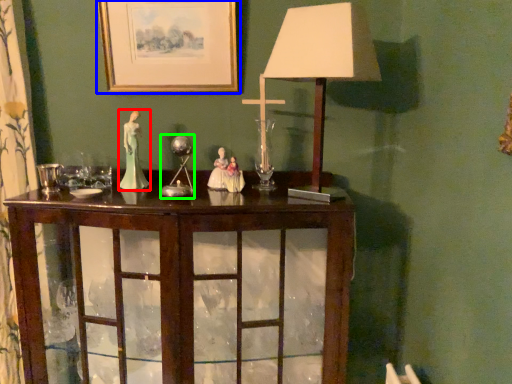
Question: Which is farther away from person (highlighted by a red box)? picture frame (highlighted by a blue box) or candle holder (highlighted by a green box)?

Choices:
 (A) picture frame
 (B) candle holder

Answer: (A)